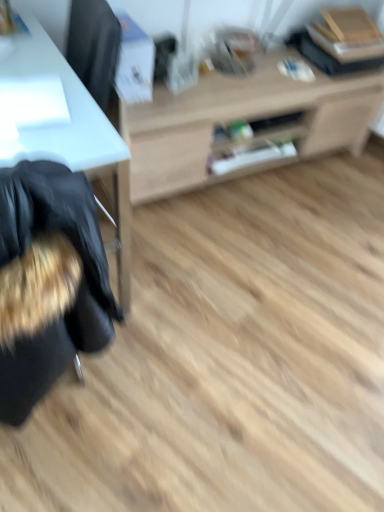
Question: Is light wood cabinet at center wider or thinner than white glossy desk at left?

Choices:
 (A) thin
 (B) wide

Answer: (A)

Question: From a real-world perspective, is light wood cabinet at center above or below white glossy desk at left?

Choices:
 (A) below
 (B) above

Answer: (A)

Question: Estimate the real-world distances between objects in this image. Which object is closer to the fuzzy black bean bag chair at left?

Choices:
 (A) white glossy desk at left
 (B) light wood cabinet at center

Answer: (A)

Question: Estimate the real-world distances between objects in this image. Which object is closer to the fuzzy black bean bag chair at left?

Choices:
 (A) light wood cabinet at center
 (B) white glossy desk at left

Answer: (B)